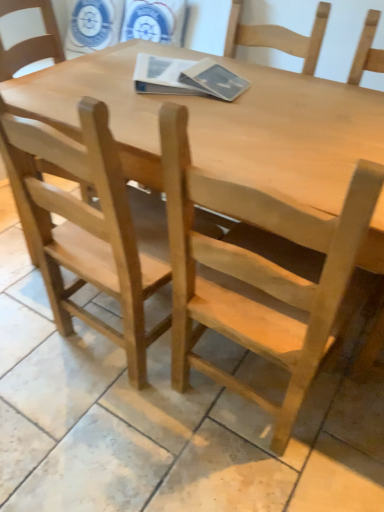
This screenshot has width=384, height=512. In order to click on vacant space situated on the left part of natural wood chair at left, the 2th chair viewed from the right in this screenshot , I will do `click(25, 329)`.